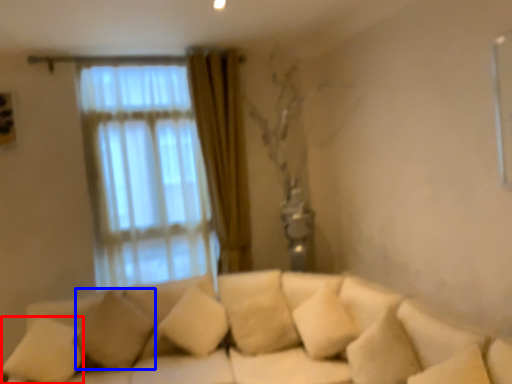
Question: Which point is closer to the camera, pillow (highlighted by a red box) or pillow (highlighted by a blue box)?

Choices:
 (A) pillow
 (B) pillow

Answer: (A)